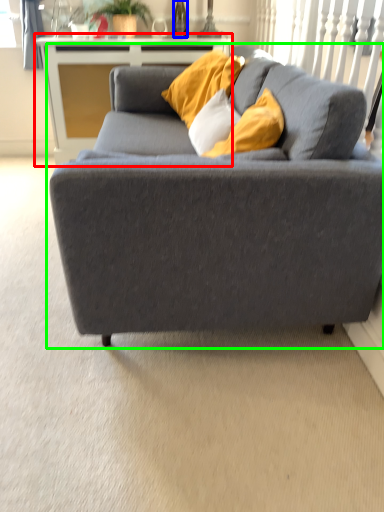
Question: Based on their relative distances, which object is nearer to table (highlighted by a red box)? Choose from wine bottle (highlighted by a blue box) and studio couch (highlighted by a green box).

Choices:
 (A) wine bottle
 (B) studio couch

Answer: (A)